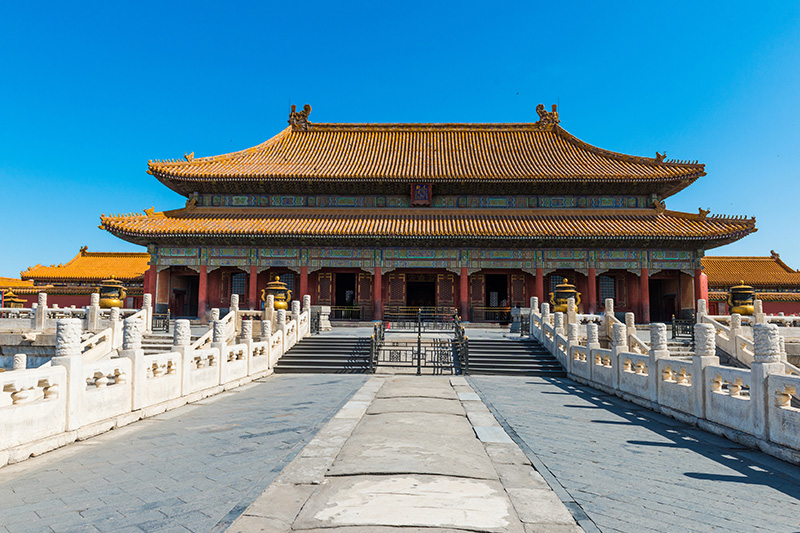
The width and height of the screenshot is (800, 533). In order to click on stairs in this screenshot , I will do `click(326, 347)`, `click(508, 352)`, `click(685, 352)`, `click(162, 343)`.